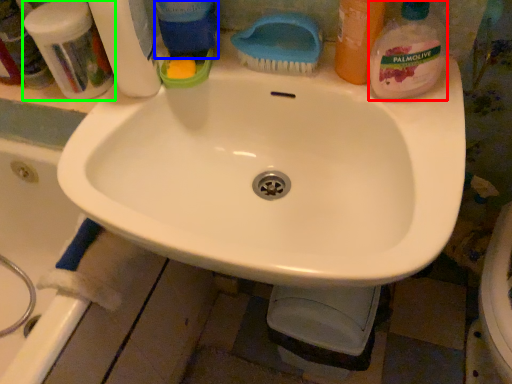
Question: Based on their relative distances, which object is farther from cleaning product (highlighted by a red box)? Choose from cleaning product (highlighted by a blue box) and toiletry (highlighted by a green box).

Choices:
 (A) cleaning product
 (B) toiletry

Answer: (B)